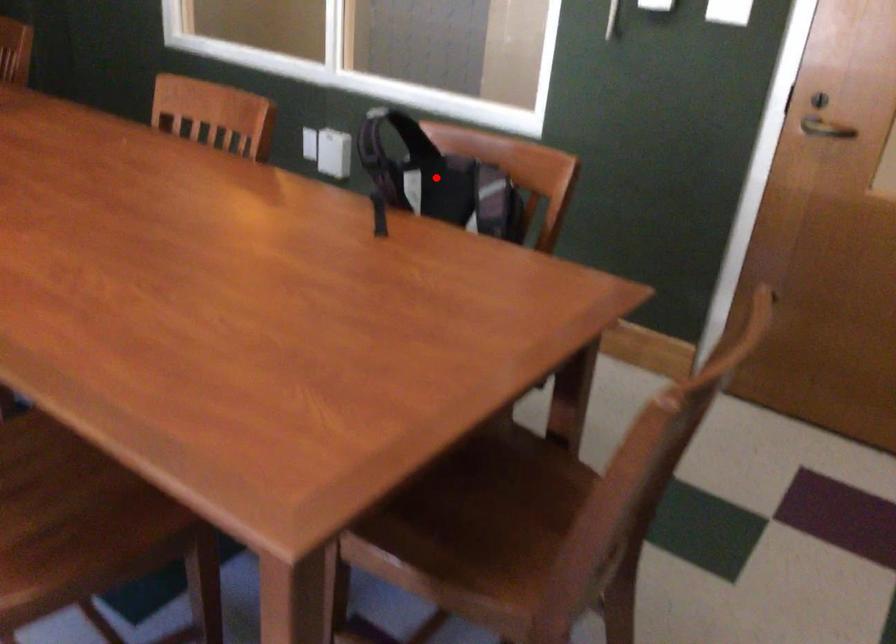
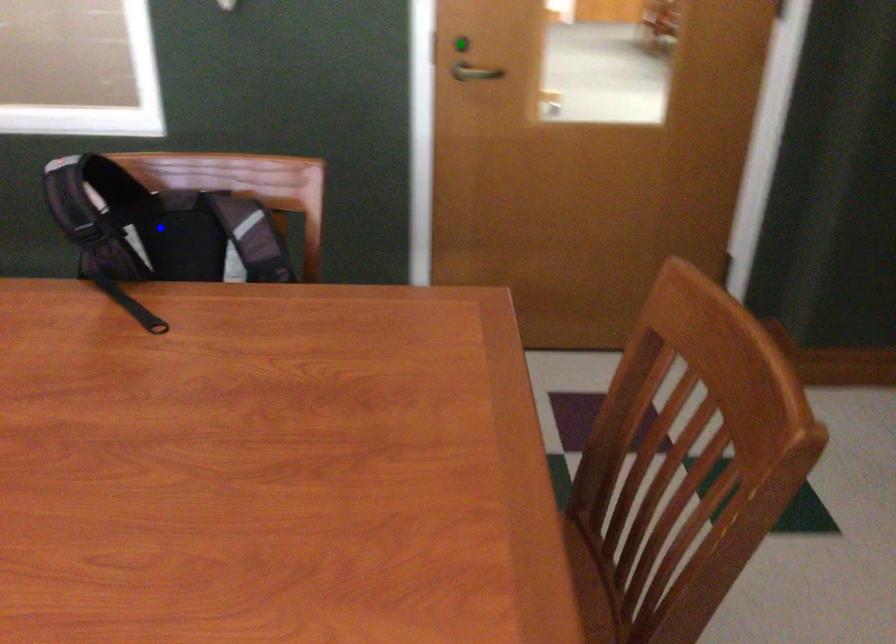
Question: I am providing you with two images of the same scene from different viewpoints. A red point is marked on the first image. You are given multiple points on the second image. Which point in image 2 is actually the same real-world point as the red point in image 1?

Choices:
 (A) green point
 (B) yellow point
 (C) blue point

Answer: (C)